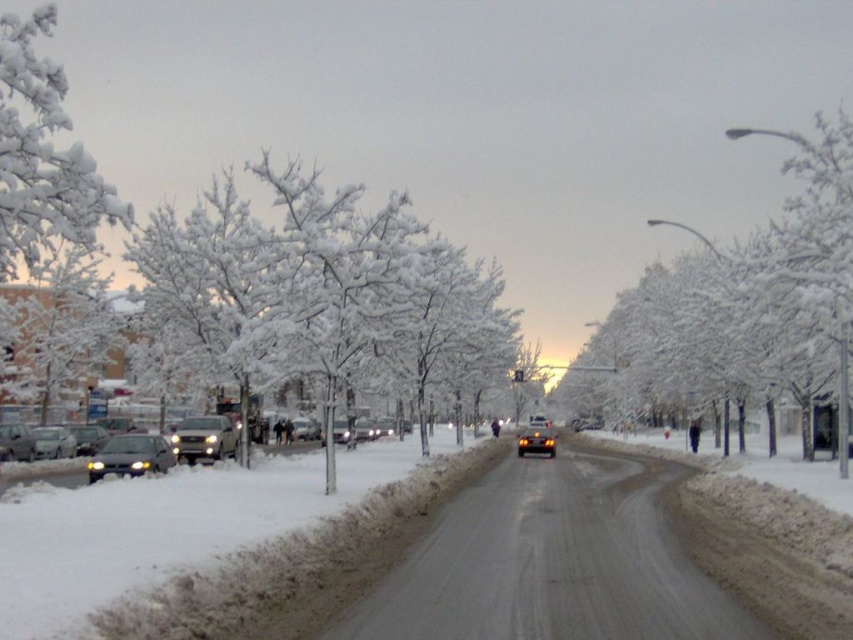
You are a delivery person trying to park your van between the shiny silver sedan at left and the satin silver suv at left. Which vehicle should you position your van closer to in order to ensure enough clearance for opening the van doors?

You should position your van closer to the satin silver suv at left because the shiny silver sedan at left is taller than the satin silver suv at left, so the suv is shorter and allows more vertical space for the van doors to open without hitting the sedan.

You are standing at the center of the snowy street and want to take a photo of the white frosty tree at upper left. In which direction should you point your camera to capture it?

The white frosty tree at upper left is located at point [42,156], which is to the upper left direction from your current position at the center. Point your camera towards the upper left to capture it.

You are a delivery person trying to park your van between the shiny silver sedan at left and the satin silver suv at left. Your van is 2 meters wide. Can you fit your van between them?

The shiny silver sedan at left might be wider than satin silver suv at left, so the space between them is uncertain. You should check the actual distance before deciding to park your van there.